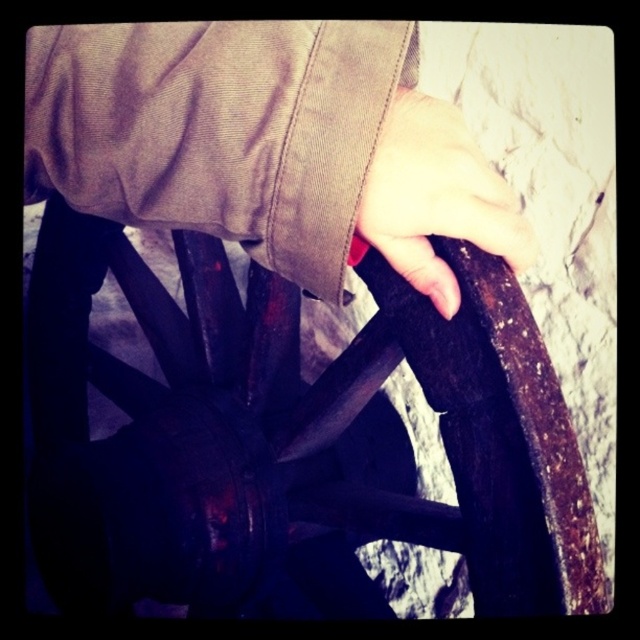
Question: Is rusty metal wagon wheel at center behind brown suede jacket at upper center?

Choices:
 (A) yes
 (B) no

Answer: (A)

Question: Which point appears farthest from the camera in this image?

Choices:
 (A) (410, 259)
 (B) (369, 113)
 (C) (33, 358)

Answer: (C)

Question: Considering the real-world distances, which object is farthest from the rusty metal wagon wheel at center?

Choices:
 (A) brown suede jacket at upper center
 (B) smooth skin hand at center

Answer: (B)

Question: Is rusty metal wagon wheel at center bigger than brown suede jacket at upper center?

Choices:
 (A) yes
 (B) no

Answer: (A)

Question: In this image, where is brown suede jacket at upper center located relative to smooth skin hand at center?

Choices:
 (A) above
 (B) below

Answer: (A)

Question: Which is farther from the rusty metal wagon wheel at center?

Choices:
 (A) brown suede jacket at upper center
 (B) smooth skin hand at center

Answer: (B)